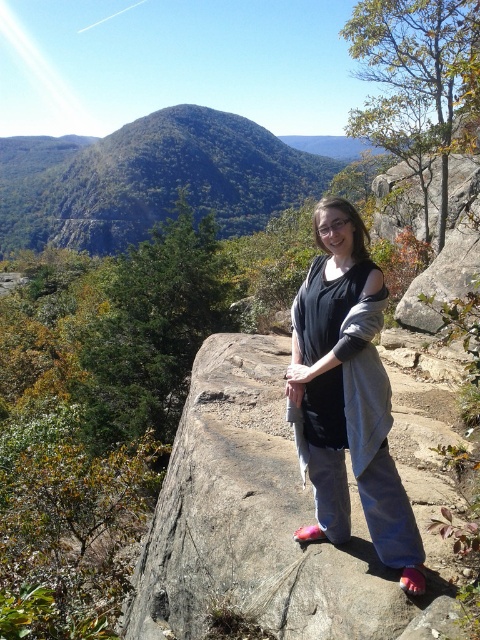
Question: Does gray/rough rock at center lie in front of gray cotton sweater at center?

Choices:
 (A) yes
 (B) no

Answer: (B)

Question: Is gray/rough rock at center thinner than gray cotton sweater at center?

Choices:
 (A) yes
 (B) no

Answer: (A)

Question: Which of the following is the farthest from the observer?

Choices:
 (A) gray cotton sweater at center
 (B) gray/rough rock at center

Answer: (B)

Question: Which point is closer to the camera?

Choices:
 (A) (348, 528)
 (B) (456, 508)

Answer: (A)

Question: Which point appears closest to the camera in this image?

Choices:
 (A) click(x=421, y=470)
 (B) click(x=325, y=333)

Answer: (B)

Question: Can you confirm if gray/rough rock at center is thinner than gray cotton sweater at center?

Choices:
 (A) yes
 (B) no

Answer: (A)